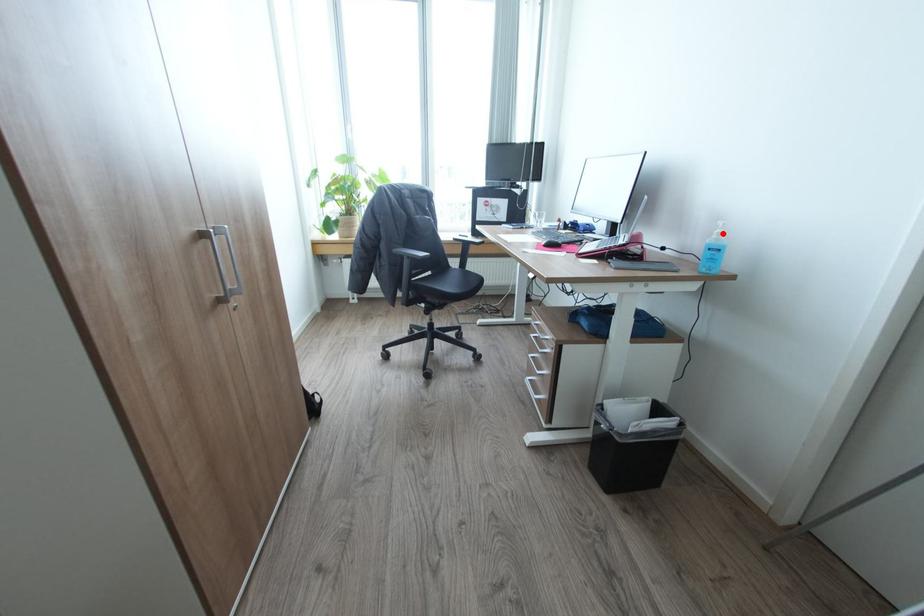
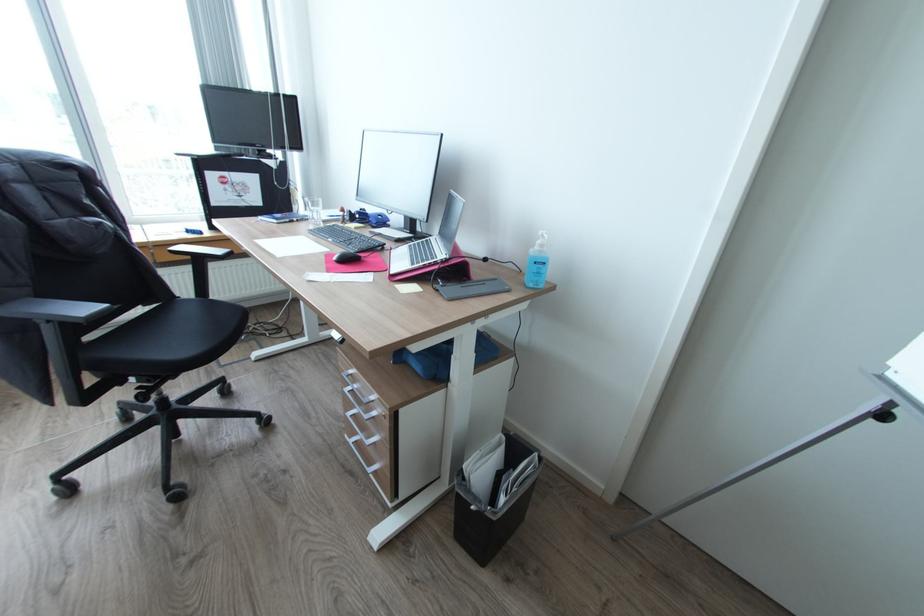
In the second image, find the point that corresponds to the highlighted location in the first image.

(545, 245)